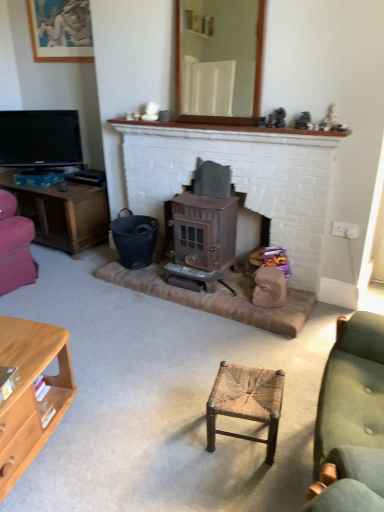
Question: From a real-world perspective, is bronze textured wood burning stove at center above or below woven wood stool at center?

Choices:
 (A) below
 (B) above

Answer: (B)

Question: Is point (193, 240) positioned closer to the camera than point (253, 415)?

Choices:
 (A) farther
 (B) closer

Answer: (A)

Question: Which is nearer to the matte black tv at left?

Choices:
 (A) matte wooden picture frame at upper left
 (B) green fabric couch at right
 (C) light brown wood cabinet at lower left
 (D) woven wood stool at center
 (E) black plastic bucket at lower left

Answer: (A)

Question: Which of these objects is positioned closest to the black plastic bucket at lower left?

Choices:
 (A) matte black tv at left
 (B) woven wood stool at center
 (C) white painted wood mantle at upper center
 (D) green fabric couch at right
 (E) bronze metallic stove at center

Answer: (E)